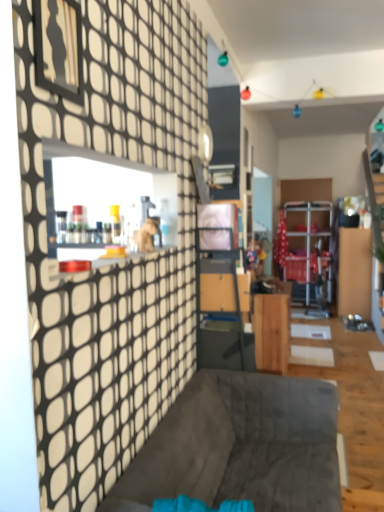
Question: Is dark gray fabric couch at center spatially inside wooden cabinet at center, or outside of it?

Choices:
 (A) inside
 (B) outside

Answer: (B)

Question: Does point (168, 429) appear closer or farther from the camera than point (279, 361)?

Choices:
 (A) farther
 (B) closer

Answer: (B)

Question: From a real-world perspective, is dark gray fabric couch at center physically located above or below wooden cabinet at center?

Choices:
 (A) below
 (B) above

Answer: (A)

Question: From the image's perspective, relative to dark gray fabric couch at center, is wooden cabinet at center above or below?

Choices:
 (A) below
 (B) above

Answer: (B)

Question: Do you think wooden cabinet at center is within dark gray fabric couch at center, or outside of it?

Choices:
 (A) inside
 (B) outside

Answer: (B)

Question: Looking at their shapes, would you say wooden cabinet at center is wider or thinner than dark gray fabric couch at center?

Choices:
 (A) thin
 (B) wide

Answer: (A)

Question: Is wooden cabinet at center taller or shorter than dark gray fabric couch at center?

Choices:
 (A) tall
 (B) short

Answer: (A)